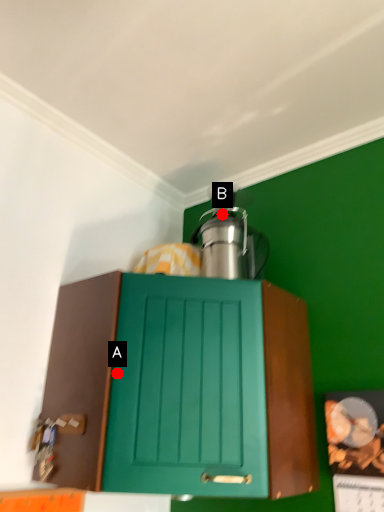
Question: Two points are circled on the image, labeled by A and B beside each circle. Among these points, which one is farthest from the camera?

Choices:
 (A) A is further
 (B) B is further

Answer: (B)